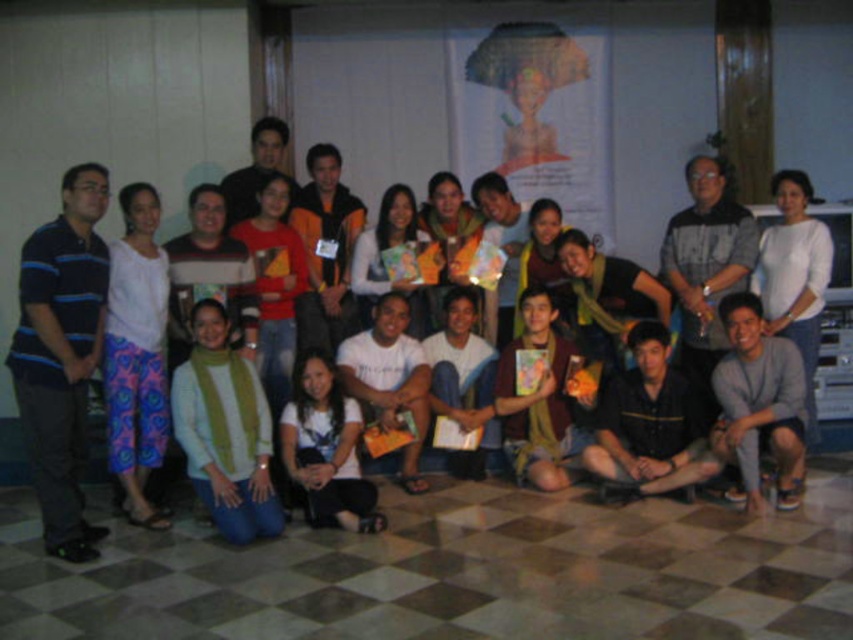
You are organizing a photo shoot and need to arrange two outfits from the scene. The striped polo shirt at left and the green knitted sweater at lower left must be placed on two mannequins. If the mannequins are the same size, which outfit should go on which mannequin to ensure proper fit?

The striped polo shirt at left is larger than the green knitted sweater at lower left. Therefore, the striped polo shirt at left should be placed on a mannequin to accommodate its larger size, while the green knitted sweater at lower left can be placed on the other mannequin since it is smaller.

You are organizing a photo shoot and need to ensure that the striped polo shirt at left and the black textured shirt at center are visible in the final image. Based on their positions, which shirt is closer to the camera?

The striped polo shirt at left is positioned under the black textured shirt at center, so the striped polo shirt at left is closer to the camera.

What is the exact coordinate of the striped polo shirt at left?

The striped polo shirt at left is located at point (61, 355).